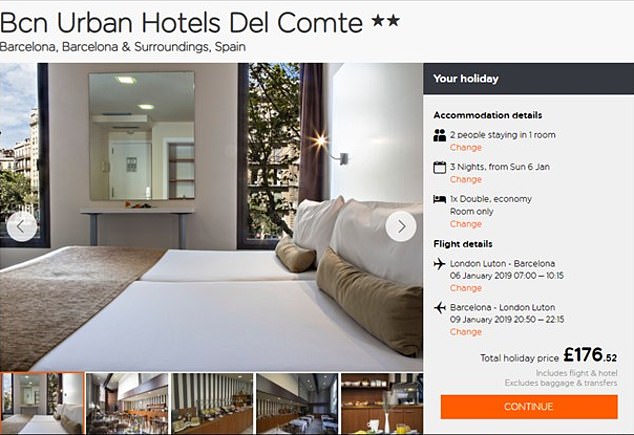
The height and width of the screenshot is (435, 634). What are the coordinates of `windows leading outside` in the screenshot? It's located at (269, 150), (15, 144).